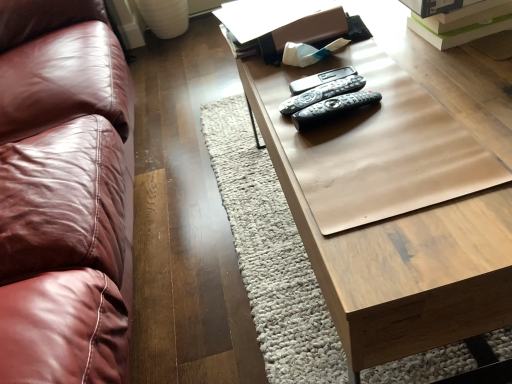
Question: Does black plastic remote at center, acting as the first remote starting from the back, come behind wooden table at center?

Choices:
 (A) yes
 (B) no

Answer: (A)

Question: From a real-world perspective, is black plastic remote at center, the third remote from the front, on wooden table at center?

Choices:
 (A) yes
 (B) no

Answer: (A)

Question: From a real-world perspective, is black plastic remote at center, the third remote from the front, positioned under wooden table at center based on gravity?

Choices:
 (A) yes
 (B) no

Answer: (B)

Question: Can you confirm if black plastic remote at center, the third remote from the front, is taller than wooden table at center?

Choices:
 (A) yes
 (B) no

Answer: (B)

Question: Is black plastic remote at center, the third remote from the front, outside wooden table at center?

Choices:
 (A) yes
 (B) no

Answer: (A)

Question: Is point (331, 109) closer or farther from the camera than point (330, 223)?

Choices:
 (A) farther
 (B) closer

Answer: (A)

Question: Is black plastic remotes at center, acting as the third remote starting from the back, bigger or smaller than wooden table at center?

Choices:
 (A) small
 (B) big

Answer: (A)

Question: Is black plastic remotes at center, acting as the third remote starting from the back, situated inside wooden table at center or outside?

Choices:
 (A) inside
 (B) outside

Answer: (B)

Question: In terms of width, does black plastic remotes at center, which appears as the first remote when viewed from the front, look wider or thinner when compared to wooden table at center?

Choices:
 (A) thin
 (B) wide

Answer: (A)

Question: Based on their positions, is black plastic remote at center, the third remote from the front, located to the left or right of black plastic remotes at center, which appears as the first remote when viewed from the front?

Choices:
 (A) right
 (B) left

Answer: (B)

Question: Based on their sizes in the image, would you say black plastic remote at center, the third remote from the front, is bigger or smaller than black plastic remotes at center, acting as the third remote starting from the back?

Choices:
 (A) small
 (B) big

Answer: (A)

Question: Is point (338, 77) closer or farther from the camera than point (295, 120)?

Choices:
 (A) closer
 (B) farther

Answer: (B)

Question: From their relative heights in the image, would you say black plastic remote at center, the third remote from the front, is taller or shorter than black plastic remotes at center, acting as the third remote starting from the back?

Choices:
 (A) tall
 (B) short

Answer: (B)

Question: Is black plastic remotes at center, which appears as the first remote when viewed from the front, in front of or behind black plastic remote at center, the third remote from the front, in the image?

Choices:
 (A) front
 (B) behind

Answer: (A)

Question: Is black plastic remotes at center, which appears as the first remote when viewed from the front, situated inside black plastic remote at center, the third remote from the front, or outside?

Choices:
 (A) inside
 (B) outside

Answer: (B)